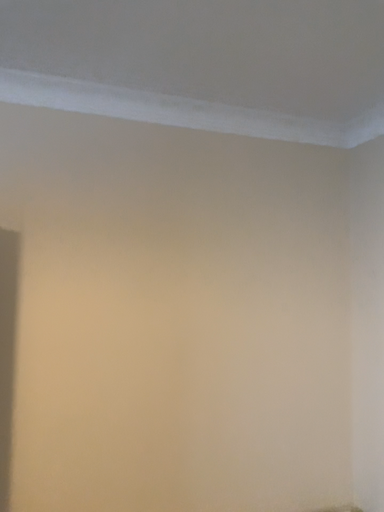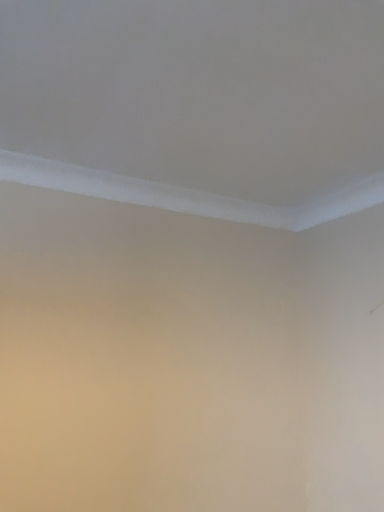
Question: How did the camera likely rotate when shooting the video?

Choices:
 (A) rotated left
 (B) rotated right

Answer: (B)